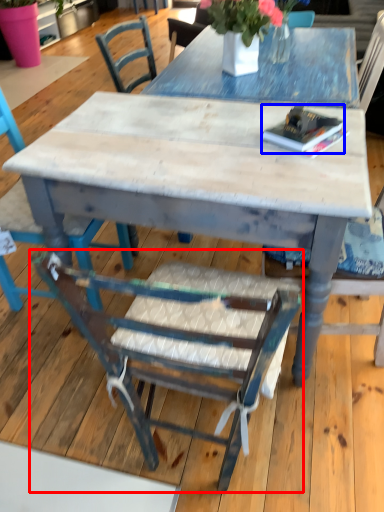
Question: Which object appears farthest to the camera in this image, chair (highlighted by a red box) or book (highlighted by a blue box)?

Choices:
 (A) chair
 (B) book

Answer: (B)